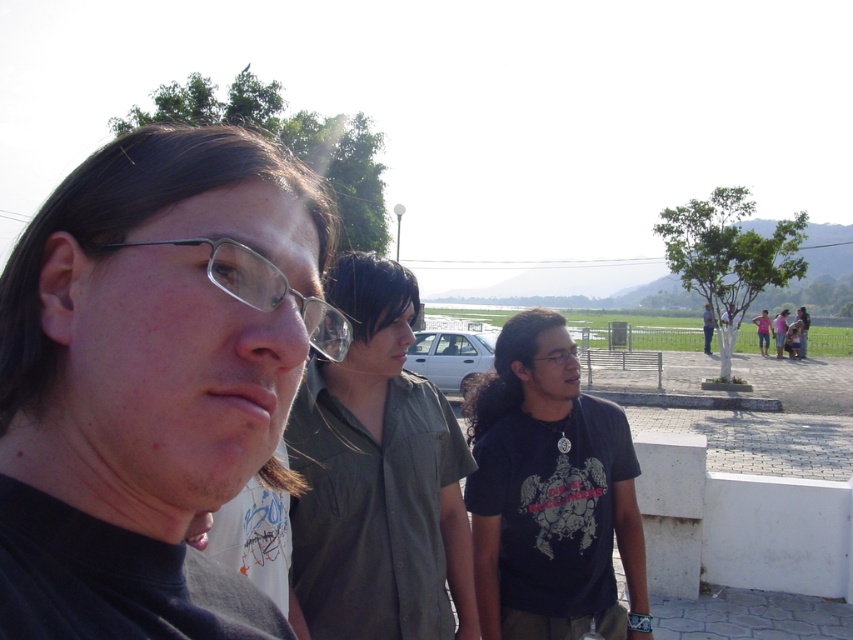
Is green matte shirt at center below clear plastic glasses at center?

Yes, green matte shirt at center is below clear plastic glasses at center.

Between point (383, 332) and point (334, 310), which one is positioned behind?

Point (383, 332)

Is point (432, 497) positioned behind point (225, 280)?

That is True.

Identify the location of green matte shirt at center. The width and height of the screenshot is (853, 640). (376, 476).

Between point (369, 280) and point (560, 358), which one is positioned in front?

Positioned in front is point (369, 280).

Does green matte shirt at center appear over matte black glasses at center?

Incorrect, green matte shirt at center is not positioned above matte black glasses at center.

Is point (344, 284) positioned before point (560, 353)?

Yes.

Identify the location of green matte shirt at center. The image size is (853, 640). (376, 476).

How much distance is there between dark blue t-shirt at center and matte black glasses at center?

dark blue t-shirt at center is 43.84 centimeters from matte black glasses at center.

Does point (606, 602) come in front of point (534, 358)?

Yes, it is in front of point (534, 358).

Identify the location of dark blue t-shirt at center. (550, 496).